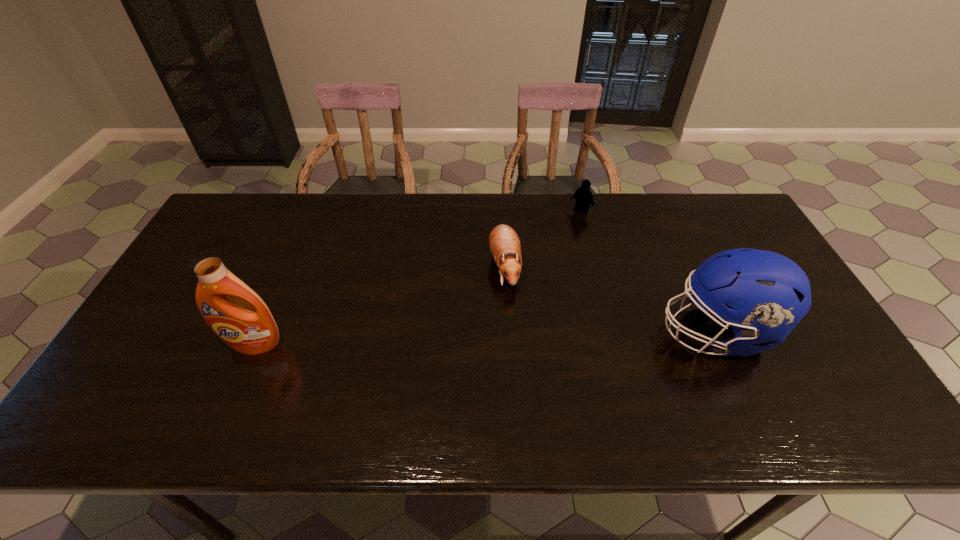
You are a GUI agent. You are given a task and a screenshot of the screen. Output one action in this format:
    pyautogui.click(x=<x>, y=<y>)
    Task: Click on the object that is positioned at the near right corner
    This screenshot has width=960, height=540.
    Given the screenshot: What is the action you would take?
    pyautogui.click(x=768, y=293)

What are the coordinates of `free space at the far edge of the desktop` in the screenshot? It's located at (543, 220).

Image resolution: width=960 pixels, height=540 pixels. In the image, there is a desktop. In order to click on free space at the near edge in this screenshot , I will do pos(607,381).

Image resolution: width=960 pixels, height=540 pixels. In the image, there is a desktop. Identify the location of free region at the right edge. (789, 335).

At what (x,y) coordinates should I click in order to perform the action: click on free space at the far left corner of the desktop. Please return your answer as a coordinate pair (x, y). This screenshot has width=960, height=540. Looking at the image, I should click on (240, 236).

Locate an element on the screen. This screenshot has width=960, height=540. free area in between the rightmost object and the second farthest object is located at coordinates 611,299.

Identify the location of free space between the leftmost object and the second farthest object. (379, 306).

You are a GUI agent. You are given a task and a screenshot of the screen. Output one action in this format:
    pyautogui.click(x=<x>, y=<y>)
    Task: Click on the free space that is in between the leftmost object and the rightmost object
    The height and width of the screenshot is (540, 960).
    Given the screenshot: What is the action you would take?
    pyautogui.click(x=486, y=338)

Identify the location of vacant space that's between the rightmost object and the leftmost object. This screenshot has width=960, height=540. (486, 338).

Identify the location of vacant space in between the rightmost object and the third nearest object. (611, 299).